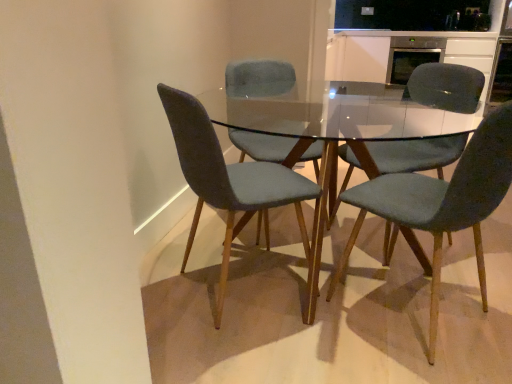
Where is `transparent glass table at center`? The width and height of the screenshot is (512, 384). transparent glass table at center is located at coordinates (244, 185).

What do you see at coordinates (244, 185) in the screenshot? I see `transparent glass table at center` at bounding box center [244, 185].

This screenshot has height=384, width=512. I want to click on velvet teal chair at center, positioned as the fourth chair in left-to-right order, so click(445, 87).

What do you see at coordinates (404, 50) in the screenshot? The width and height of the screenshot is (512, 384). I see `satin white cabinet at upper right` at bounding box center [404, 50].

Identify the location of transparent glass table at center. The height and width of the screenshot is (384, 512). (244, 185).

Looking at their sizes, would you say transparent glass table at center is wider or thinner than velvet grey chair at center, positioned as the 2th chair in left-to-right order?

transparent glass table at center is wider than velvet grey chair at center, positioned as the 2th chair in left-to-right order.

The height and width of the screenshot is (384, 512). I want to click on the 2nd chair behind the transparent glass table at center, starting your count from the anchor, so click(x=259, y=79).

Based on the photo, is transparent glass table at center oriented away from velvet grey chair at center, positioned as the 2th chair in left-to-right order?

Yes, velvet grey chair at center, positioned as the 2th chair in left-to-right order, is at the back of transparent glass table at center.

From the image's perspective, is transparent glass table at center located beneath velvet grey chair at center, placed as the 3th chair when sorted from right to left?

Correct, transparent glass table at center appears lower than velvet grey chair at center, placed as the 3th chair when sorted from right to left, in the image.

Find the location of a particular element. kitchen & dining room table on the right of velvet grey chair at center, the 1th chair in the left-to-right sequence is located at coordinates (244, 185).

Is point (224, 275) more distant than point (175, 111)?

Yes.

Does velvet grey chair at center, positioned as the 4th chair in right-to-left order, turn towards transparent glass table at center?

Yes, velvet grey chair at center, positioned as the 4th chair in right-to-left order, is facing transparent glass table at center.

Image resolution: width=512 pixels, height=384 pixels. In order to click on kitchen & dining room table above the velvet grey chair at center, positioned as the 4th chair in right-to-left order (from the image's perspective) in this screenshot , I will do `click(244, 185)`.

Consider the image. Can you see velvet grey chair at center, positioned as the 4th chair in right-to-left order, touching transparent glass table at center?

Yes, velvet grey chair at center, positioned as the 4th chair in right-to-left order, is with transparent glass table at center.

Does point (314, 229) come behind point (468, 224)?

Yes, point (314, 229) is farther from viewer.

This screenshot has width=512, height=384. I want to click on cabinetry above the transparent glass table at center (from the image's perspective), so click(404, 50).

Is point (374, 60) closer or farther from the camera than point (311, 289)?

Point (374, 60) is positioned farther from the camera compared to point (311, 289).

From the image's perspective, is satin white cabinet at upper right above or below transparent glass table at center?

satin white cabinet at upper right is above transparent glass table at center.

Is satin white cabinet at upper right not close to transparent glass table at center?

That's right, there is a large distance between satin white cabinet at upper right and transparent glass table at center.

Where is `chair that is the 4th object located in front of the satin white cabinet at upper right`? This screenshot has height=384, width=512. chair that is the 4th object located in front of the satin white cabinet at upper right is located at coordinates (442, 202).

Considering the positions of points (465, 166) and (486, 57), is point (465, 166) farther from camera compared to point (486, 57)?

No.

Based on their sizes in the image, would you say velvet teal chair at center, which is counted as the 2th chair, starting from the right, is bigger or smaller than satin white cabinet at upper right?

In the image, velvet teal chair at center, which is counted as the 2th chair, starting from the right, appears to be smaller than satin white cabinet at upper right.

From the image's perspective, between stainless steel oven at upper right and velvet grey chair at center, positioned as the 4th chair in right-to-left order, which one is located above?

stainless steel oven at upper right is shown above in the image.

Considering the sizes of objects stainless steel oven at upper right and velvet grey chair at center, positioned as the 4th chair in right-to-left order, in the image provided, who is thinner, stainless steel oven at upper right or velvet grey chair at center, positioned as the 4th chair in right-to-left order,?

With smaller width is velvet grey chair at center, positioned as the 4th chair in right-to-left order.

Which is behind, point (396, 36) or point (305, 197)?

The point (396, 36) is farther from the camera.

Would you say stainless steel oven at upper right is inside or outside velvet grey chair at center, positioned as the 4th chair in right-to-left order?

The correct answer is: outside.

Is velvet teal chair at center, which ranks as the 1th chair in right-to-left order, not inside velvet grey chair at center, positioned as the 4th chair in right-to-left order?

That's correct, velvet teal chair at center, which ranks as the 1th chair in right-to-left order, is outside of velvet grey chair at center, positioned as the 4th chair in right-to-left order.

In the image, is velvet teal chair at center, which ranks as the 1th chair in right-to-left order, positioned in front of or behind velvet grey chair at center, the 1th chair in the left-to-right sequence?

In the image, velvet teal chair at center, which ranks as the 1th chair in right-to-left order, appears behind velvet grey chair at center, the 1th chair in the left-to-right sequence.

From the image's perspective, is velvet teal chair at center, positioned as the fourth chair in left-to-right order, above or below velvet grey chair at center, positioned as the 4th chair in right-to-left order?

velvet teal chair at center, positioned as the fourth chair in left-to-right order, is above velvet grey chair at center, positioned as the 4th chair in right-to-left order.

Considering the positions of point (453, 138) and point (187, 179), is point (453, 138) closer or farther from the camera than point (187, 179)?

Point (453, 138) is farther from the camera than point (187, 179).

In the image, there is a velvet grey chair at center, positioned as the 2th chair in left-to-right order. Where is `kitchen & dining room table below it (from the image's perspective)`? kitchen & dining room table below it (from the image's perspective) is located at coordinates (244, 185).

Find the location of a particular element. The image size is (512, 384). kitchen & dining room table that is behind the velvet grey chair at center, the 1th chair in the left-to-right sequence is located at coordinates (244, 185).

Estimate the real-world distances between objects in this image. Which object is further from satin white cabinet at upper right, velvet grey chair at center, positioned as the 2th chair in left-to-right order, or transparent glass table at center?

transparent glass table at center lies further to satin white cabinet at upper right than the other object.

Estimate the real-world distances between objects in this image. Which object is closer to stainless steel oven at upper right, satin white cabinet at upper right or velvet teal chair at center, which ranks as the 1th chair in right-to-left order?

Based on the image, satin white cabinet at upper right appears to be nearer to stainless steel oven at upper right.

Looking at the image, which one is located closer to satin white cabinet at upper right, stainless steel oven at upper right or velvet grey chair at center, positioned as the 4th chair in right-to-left order?

Based on the image, stainless steel oven at upper right appears to be nearer to satin white cabinet at upper right.

When comparing their distances from velvet grey chair at center, the 1th chair in the left-to-right sequence, does velvet grey chair at center, positioned as the 2th chair in left-to-right order, or velvet teal chair at center, which is counted as the 2th chair, starting from the right, seem closer?

velvet teal chair at center, which is counted as the 2th chair, starting from the right, is positioned closer to the anchor velvet grey chair at center, the 1th chair in the left-to-right sequence.

When comparing their distances from velvet teal chair at center, which is counted as the 2th chair, starting from the right, does satin white cabinet at upper right or velvet grey chair at center, the 1th chair in the left-to-right sequence, seem further?

satin white cabinet at upper right is further to velvet teal chair at center, which is counted as the 2th chair, starting from the right.

Looking at the image, which one is located further to transparent glass table at center, velvet teal chair at center, placed as the third chair when sorted from left to right, or satin white cabinet at upper right?

Based on the image, satin white cabinet at upper right appears to be further to transparent glass table at center.

Considering their positions, is velvet teal chair at center, which ranks as the 1th chair in right-to-left order, positioned closer to transparent glass table at center than velvet teal chair at center, which is counted as the 2th chair, starting from the right?

The object closer to transparent glass table at center is velvet teal chair at center, which is counted as the 2th chair, starting from the right.

Considering their positions, is velvet grey chair at center, positioned as the 4th chair in right-to-left order, positioned closer to stainless steel oven at upper right than velvet teal chair at center, which ranks as the 1th chair in right-to-left order?

Based on the image, velvet teal chair at center, which ranks as the 1th chair in right-to-left order, appears to be nearer to stainless steel oven at upper right.

This screenshot has height=384, width=512. What are the coordinates of `kitchen & dining room table between velvet grey chair at center, positioned as the 4th chair in right-to-left order, and satin white cabinet at upper right in the front-back direction` in the screenshot? It's located at (244, 185).

Find the location of a particular element. The height and width of the screenshot is (384, 512). cabinetry between velvet grey chair at center, the 1th chair in the left-to-right sequence, and stainless steel oven at upper right in the front-back direction is located at coordinates (404, 50).

Locate an element on the screen. The width and height of the screenshot is (512, 384). kitchen & dining room table situated between velvet grey chair at center, positioned as the 4th chair in right-to-left order, and velvet teal chair at center, which ranks as the 1th chair in right-to-left order, from left to right is located at coordinates (244, 185).

Locate an element on the screen. The height and width of the screenshot is (384, 512). kitchen & dining room table located between velvet grey chair at center, positioned as the 4th chair in right-to-left order, and stainless steel oven at upper right in the depth direction is located at coordinates (244, 185).